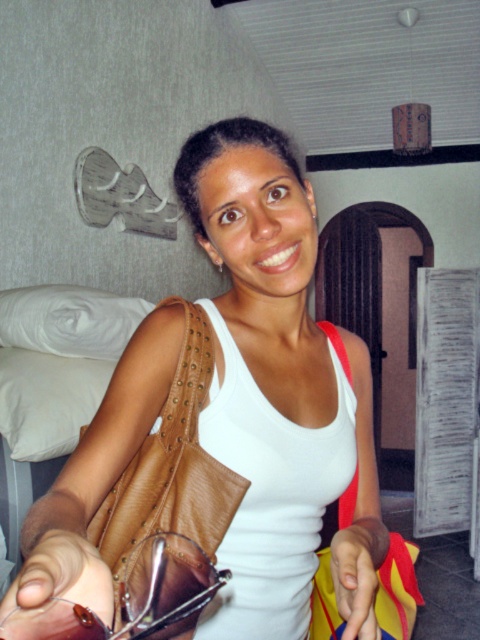
You are a fashion designer observing the image. You need to determine which item has a wider width between the leather at left and the leather glasses at lower left. Based on the scene, which one is wider?

The leather at left is wider than the leather glasses at lower left.

You are a photographer standing 24 inches away from the camera. You want to take a photo of the leather at left. Can you reach it without moving your position?

The leather at left is 19.07 inches away from the camera. Since you are 24 inches away from the camera, you are farther than the leather. To reach it, you need to move closer to the camera by approximately 4.93 inches.